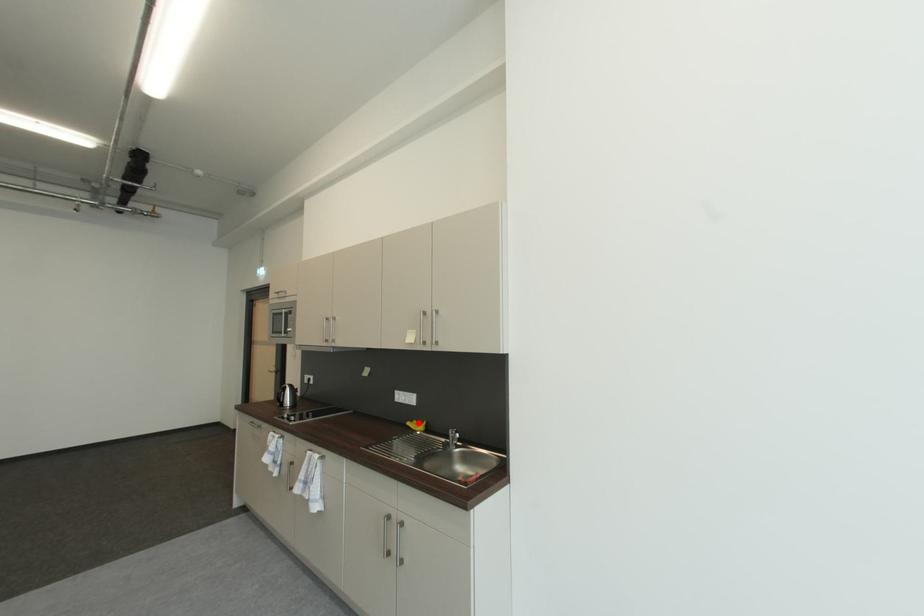
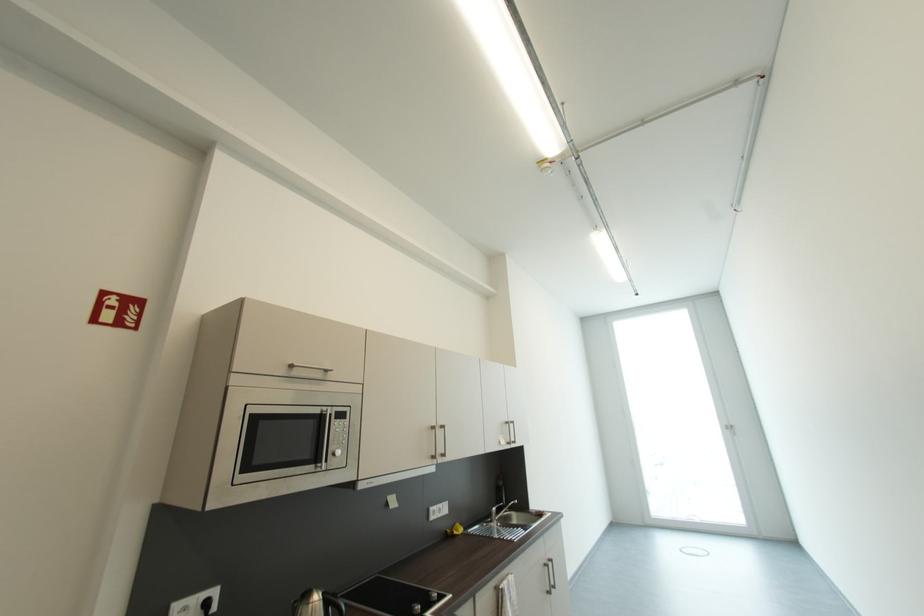
Locate, in the second image, the point that corresponds to the highlighted location in the first image.

(454, 533)